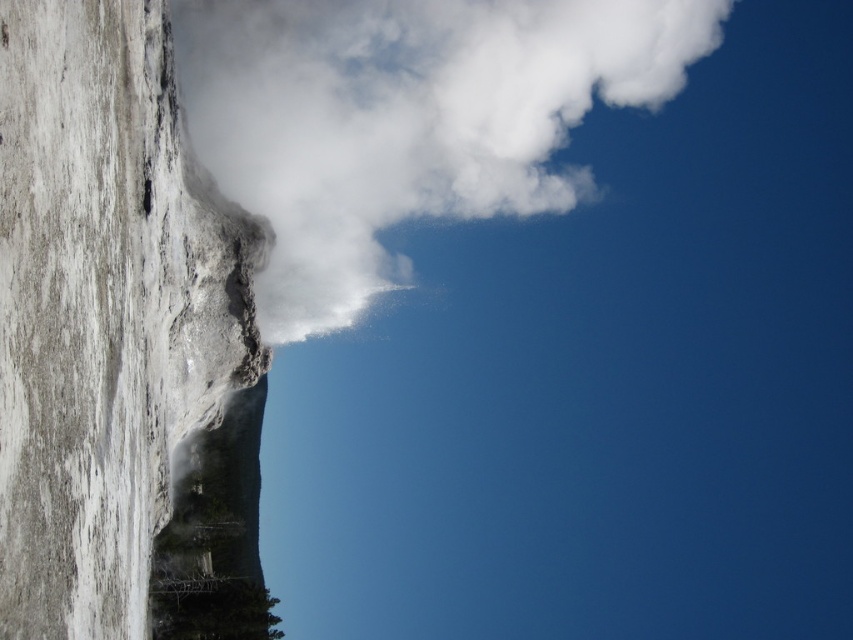
You are a photographer standing in front of the geyser scene. You want to capture a photo where the white stone rock face at left and the white vapor cloud at upper center are both visible. Based on their positions, which object should you adjust your camera angle to focus on first to ensure both are in the frame?

The white stone rock face at left is to the left of white vapor cloud at upper center, so you should adjust your camera angle to focus on the white stone rock face at left first to ensure both are in the frame.

You are a drone operator trying to capture footage of the geyser. Your drone has a maximum flight range of 100 feet. If you are positioned at the white stone rock face at left, can you fly your drone to the white vapor cloud at upper center without exceeding its range?

The white stone rock face at left is 116.91 feet from the white vapor cloud at upper center. Since the drone has a maximum range of 100 feet, it cannot reach the white vapor cloud at upper center from the white stone rock face at left without exceeding its range.